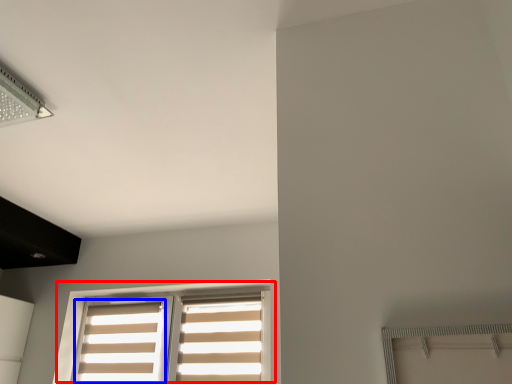
Question: Among these objects, which one is farthest to the camera, window (highlighted by a red box) or curtain (highlighted by a blue box)?

Choices:
 (A) window
 (B) curtain

Answer: (B)